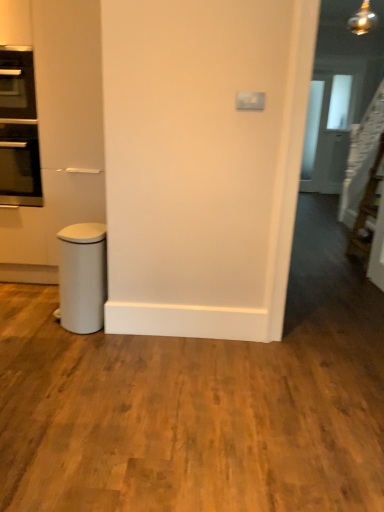
I want to click on vacant space in front of white matte waste bin at lower left, so click(87, 349).